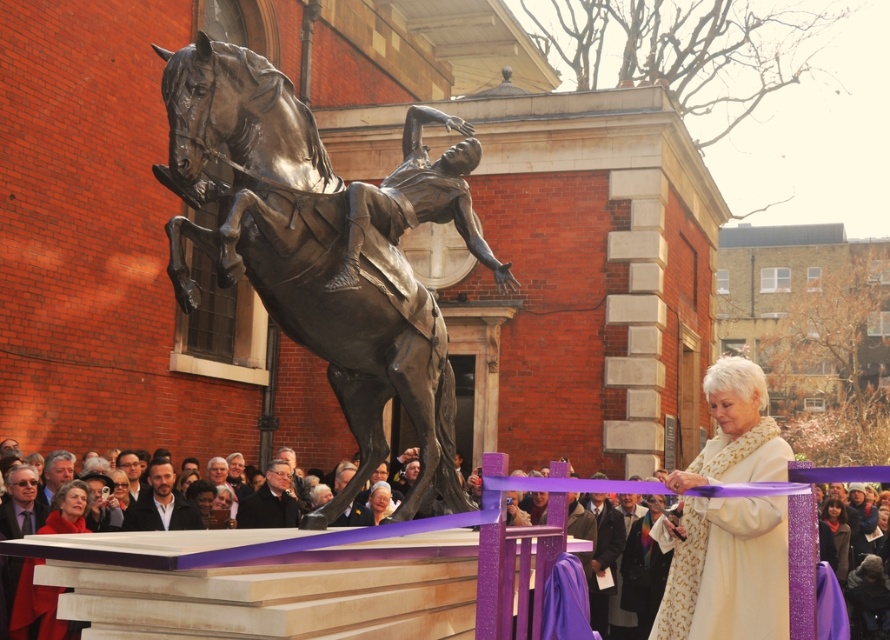
Question: Can you confirm if dark gray wool coat at lower center is wider than white textured scarf at lower right?

Choices:
 (A) yes
 (B) no

Answer: (A)

Question: Which point is farther to the camera?

Choices:
 (A) smooth brown hair at center
 (B) dark gray wool coat at lower center
 (C) dark brown leather coat at center
 (D) matte black suit at lower left

Answer: (C)

Question: Is dark gray wool coat at lower center wider than dark gray suit at center?

Choices:
 (A) no
 (B) yes

Answer: (B)

Question: Can you confirm if dark gray wool coat at lower center is smaller than matte red coat at lower left?

Choices:
 (A) no
 (B) yes

Answer: (A)

Question: Which point is farther from the camera taking this photo?

Choices:
 (A) (146, 497)
 (B) (605, 611)
 (C) (134, 483)

Answer: (B)

Question: Which is nearer to the smooth brown hair at center?

Choices:
 (A) white textured scarf at lower right
 (B) dark gray wool coat at lower center
 (C) bronze statue at center
 (D) matte red coat at lower left

Answer: (D)